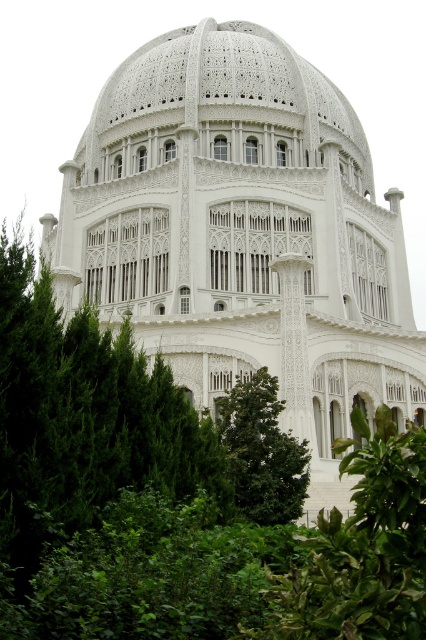
You are standing in the garden area surrounded by lush greenery and looking towards the grand white architectural structure. Where is the white stone dome at center positioned relative to your viewpoint?

The white stone dome at center is positioned at coordinates point (242, 234) relative to your viewpoint.

You are standing in front of a Bahai House of Worship surrounded by lush greenery. You notice a point marked at coordinates (242, 234). Based on the scene, which architectural feature does this point most likely represent?

The point at coordinates (242, 234) most likely represents the white stone dome at center, as it is the central and most prominent feature of the Bahai House of Worship depicted in the scene.

Based on the photo, you are a drone operator tasked with capturing aerial footage of the white stone dome at center and the green leafy tree at center. Given that the drone has a maximum flight altitude of 50 meters, can you confirm if the drone will be able to fully capture both objects in a single shot without exceeding its altitude limit?

The white stone dome at center is much taller than the green leafy tree at center. Since the drone has a maximum flight altitude of 50 meters, it can ascend to that height to capture both objects in a single shot as the dome is taller and the tree is shorter, ensuring both are within the drone operator view at that altitude.